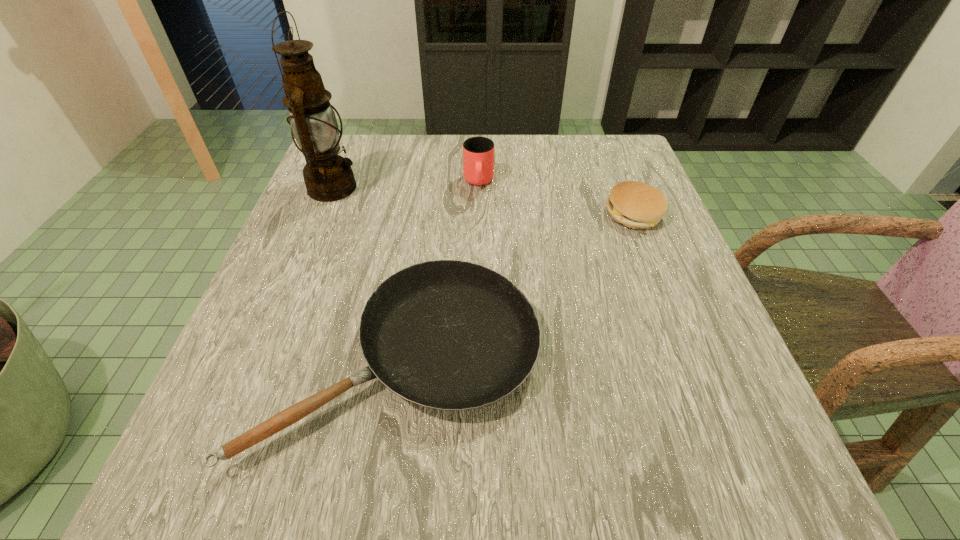
What are the coordinates of `free space at the left edge of the desktop` in the screenshot? It's located at (263, 411).

Where is `free space at the right edge of the desktop`? The height and width of the screenshot is (540, 960). free space at the right edge of the desktop is located at coordinates (624, 254).

Where is `free location at the far left corner`? Image resolution: width=960 pixels, height=540 pixels. free location at the far left corner is located at coordinates (391, 140).

This screenshot has width=960, height=540. What are the coordinates of `vacant area at the near left corner of the desktop` in the screenshot? It's located at (204, 481).

In the image, there is a desktop. Where is `free space at the far right corner`? This screenshot has width=960, height=540. free space at the far right corner is located at coordinates (619, 143).

This screenshot has height=540, width=960. What are the coordinates of `empty space that is in between the oil lamp and the second shortest object` in the screenshot? It's located at (483, 201).

Identify the location of free space between the nearest object and the tallest object. (367, 273).

The height and width of the screenshot is (540, 960). Find the location of `vacant point located between the rightmost object and the cup`. vacant point located between the rightmost object and the cup is located at coordinates (556, 198).

Where is `free space between the second shortest object and the oil lamp`? Image resolution: width=960 pixels, height=540 pixels. free space between the second shortest object and the oil lamp is located at coordinates (483, 201).

The height and width of the screenshot is (540, 960). I want to click on free space between the nearest object and the oil lamp, so click(367, 273).